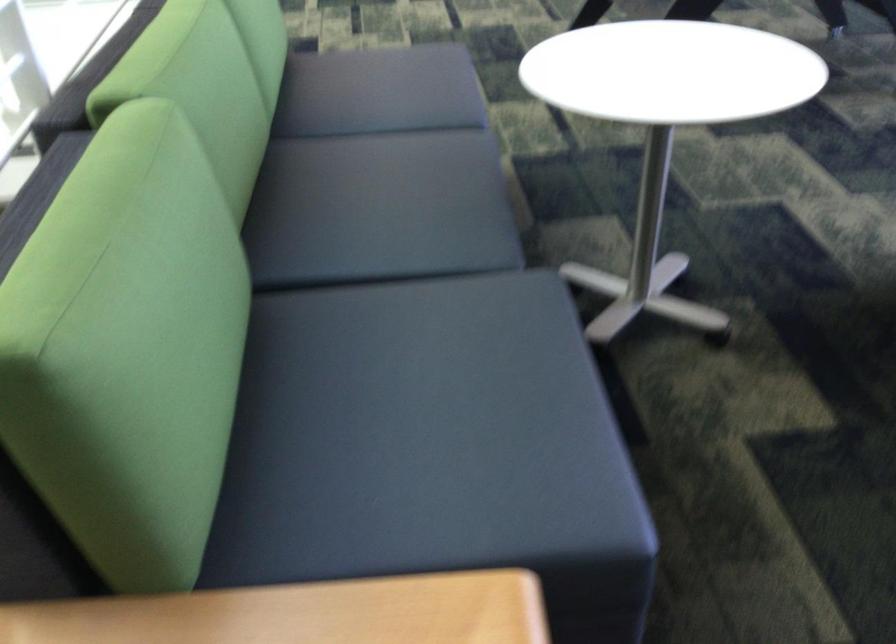
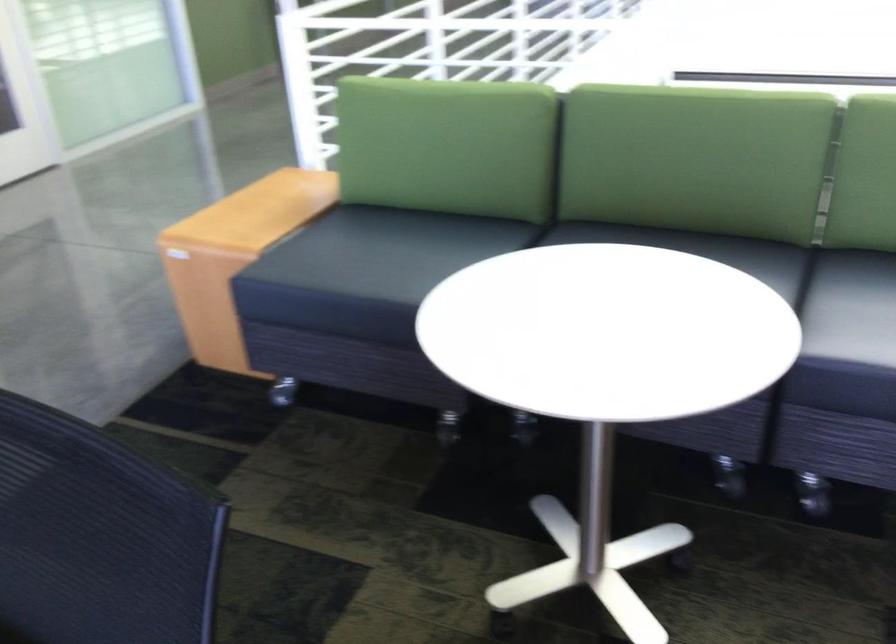
Locate, in the second image, the point that corresponds to [441,388] in the first image.

(383, 251)